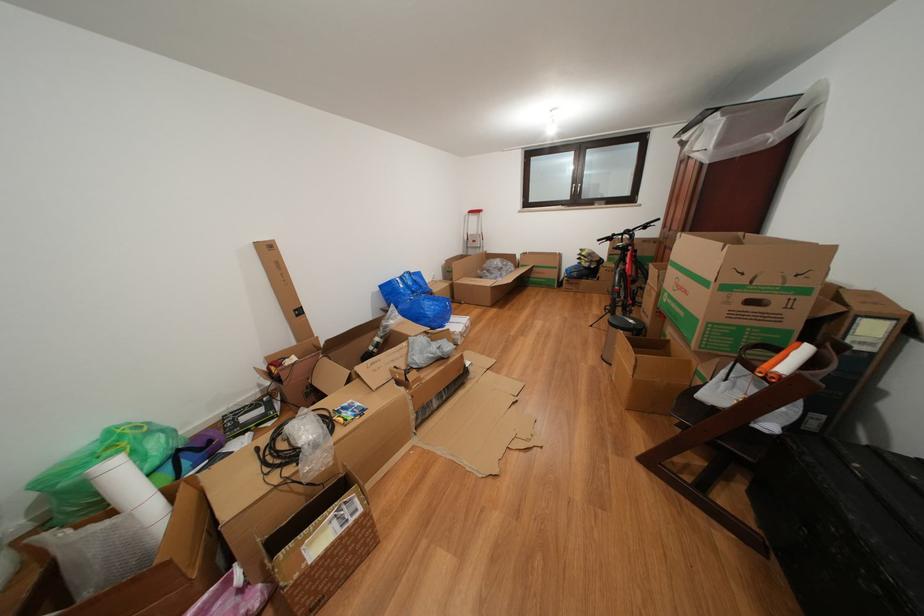
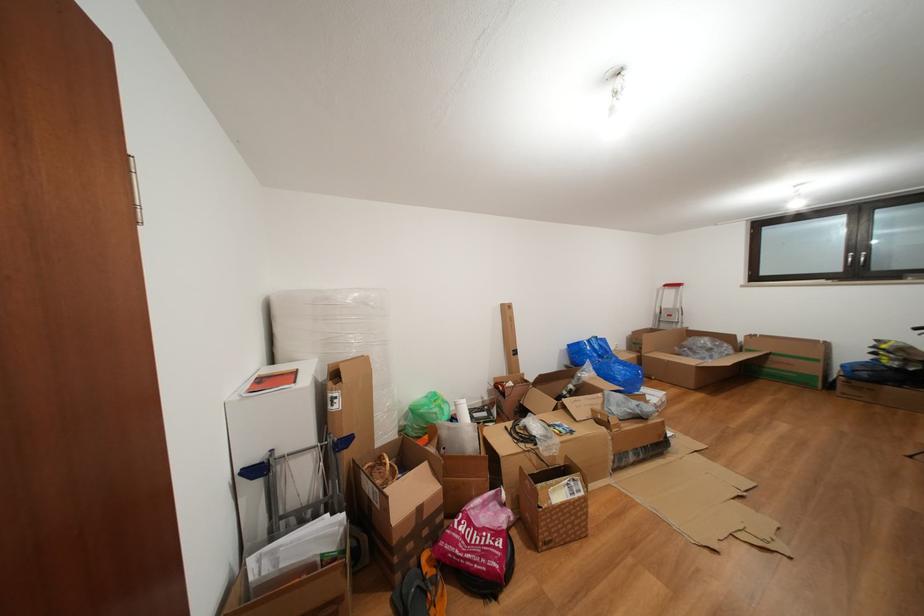
Locate, in the second image, the point that corresponds to point (289, 560) in the first image.

(546, 491)